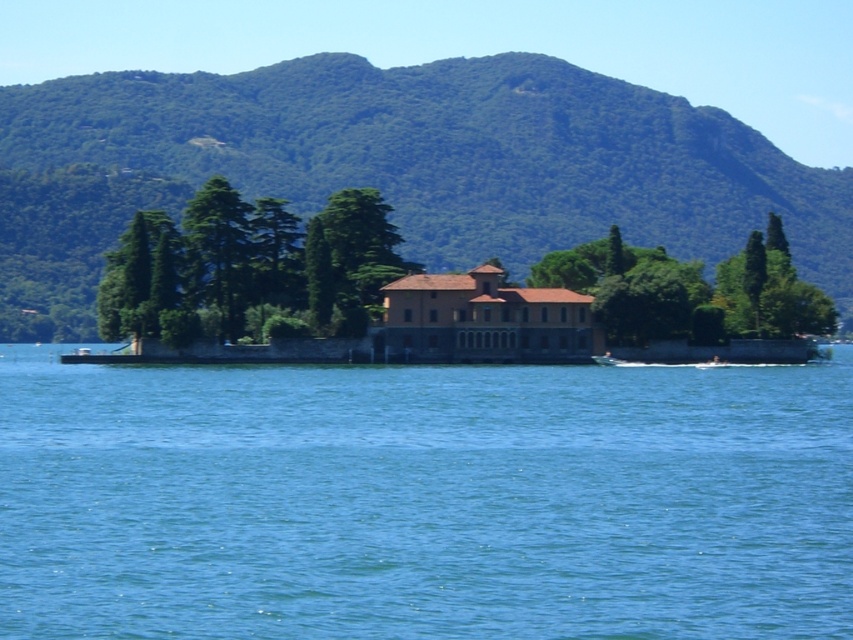
You are standing on the lakeside dock and looking towards the island. Which object, the blue water at center or the green textured trees at center, appears nearer to you?

The blue water at center appears nearer to you because it is closer to the viewer than the green textured trees at center.

You are standing on the lakeside looking at the island with the villa. There are two green textured trees at center and a green textured tree at center in the scene. Which of these trees is closer to you?

The green textured trees at center are closer to the viewer than the green textured tree at center.